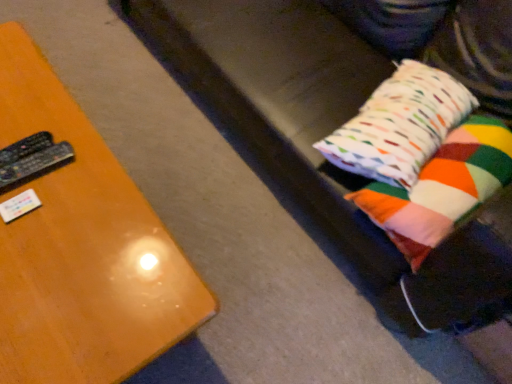
Question: Is black plastic remote at left, which is counted as the 1th remote, starting from the bottom, at the right side of black plastic remote at left, placed as the 1th remote when sorted from top to bottom?

Choices:
 (A) yes
 (B) no

Answer: (A)

Question: Is black plastic remote at left, which is counted as the 1th remote, starting from the bottom, bigger than black plastic remote at left, which is the second remote in bottom-to-top order?

Choices:
 (A) no
 (B) yes

Answer: (B)

Question: Does black plastic remote at left, which is counted as the 1th remote, starting from the bottom, have a lesser height compared to black plastic remote at left, which is the second remote in bottom-to-top order?

Choices:
 (A) yes
 (B) no

Answer: (A)

Question: Considering the relative sizes of black plastic remote at left, which is counted as the 1th remote, starting from the bottom, and black plastic remote at left, placed as the 1th remote when sorted from top to bottom, in the image provided, is black plastic remote at left, which is counted as the 1th remote, starting from the bottom, smaller than black plastic remote at left, placed as the 1th remote when sorted from top to bottom,?

Choices:
 (A) no
 (B) yes

Answer: (A)

Question: From a real-world perspective, is black plastic remote at left, which is counted as the 1th remote, starting from the bottom, positioned under black plastic remote at left, placed as the 1th remote when sorted from top to bottom, based on gravity?

Choices:
 (A) no
 (B) yes

Answer: (A)

Question: From the image's perspective, relative to wooden table at left, is multicolored fabric pillow at right, the 1th pillow from the top, above or below?

Choices:
 (A) below
 (B) above

Answer: (B)

Question: Visually, is multicolored fabric pillow at right, which is the 2th pillow in bottom-to-top order, positioned to the left or to the right of wooden table at left?

Choices:
 (A) left
 (B) right

Answer: (B)

Question: Considering the positions of point (416, 130) and point (76, 162), is point (416, 130) closer or farther from the camera than point (76, 162)?

Choices:
 (A) farther
 (B) closer

Answer: (A)

Question: In terms of height, does multicolored fabric pillow at right, the 1th pillow from the top, look taller or shorter compared to wooden table at left?

Choices:
 (A) tall
 (B) short

Answer: (B)

Question: Is black plastic remote at left, which is the second remote in bottom-to-top order, in front of or behind black plastic remote at left, which is counted as the 1th remote, starting from the bottom, in the image?

Choices:
 (A) front
 (B) behind

Answer: (B)

Question: Is black plastic remote at left, placed as the 1th remote when sorted from top to bottom, spatially inside black plastic remote at left, which is counted as the 1th remote, starting from the bottom, or outside of it?

Choices:
 (A) inside
 (B) outside

Answer: (B)

Question: In terms of height, does black plastic remote at left, which is the second remote in bottom-to-top order, look taller or shorter compared to black plastic remote at left, which is counted as the 1th remote, starting from the bottom?

Choices:
 (A) short
 (B) tall

Answer: (B)

Question: From a real-world perspective, is black plastic remote at left, which is the second remote in bottom-to-top order, above or below black plastic remote at left, placed as the second remote when sorted from top to bottom?

Choices:
 (A) above
 (B) below

Answer: (B)

Question: Is black plastic remote at left, placed as the 1th remote when sorted from top to bottom, bigger or smaller than multicolored fabric pillow at right, the 1th pillow from the top?

Choices:
 (A) small
 (B) big

Answer: (A)

Question: From a real-world perspective, relative to multicolored fabric pillow at right, which is the 2th pillow in bottom-to-top order, is black plastic remote at left, which is the second remote in bottom-to-top order, vertically above or below?

Choices:
 (A) below
 (B) above

Answer: (A)